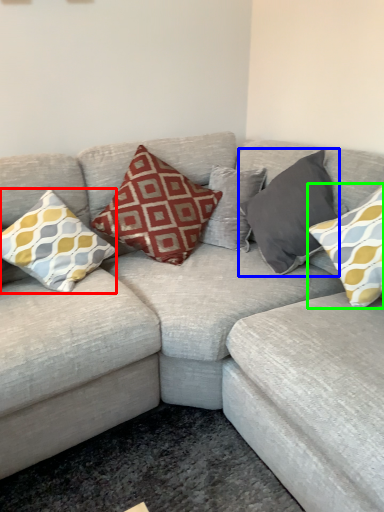
Question: Considering the real-world distances, which object is closest to pillow (highlighted by a red box)? pillow (highlighted by a blue box) or pillow (highlighted by a green box).

Choices:
 (A) pillow
 (B) pillow

Answer: (A)